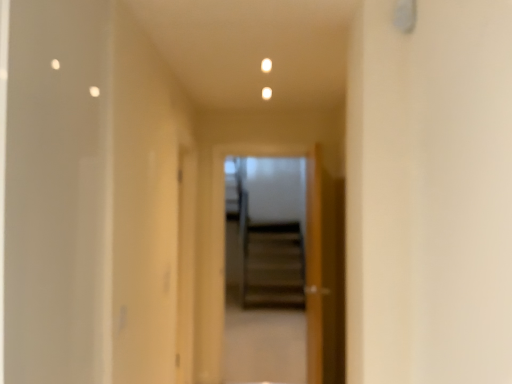
From the picture: Measure the distance between wooden door at center and camera.

wooden door at center is 8.91 feet from camera.

Describe the element at coordinates (314, 266) in the screenshot. I see `wooden door at center` at that location.

This screenshot has height=384, width=512. Find the location of `wooden door at center`. wooden door at center is located at coordinates (314, 266).

In order to face transparent glass screen door at center, should I rotate leftwards or rightwards?

You should rotate right by 0.951 degrees.

Find the location of a particular element. The image size is (512, 384). transparent glass screen door at center is located at coordinates (283, 240).

Describe the element at coordinates (283, 240) in the screenshot. I see `transparent glass screen door at center` at that location.

This screenshot has width=512, height=384. What are the coordinates of `wooden door at center` in the screenshot? It's located at (314, 266).

Is wooden door at center to the left or to the right of transparent glass screen door at center in the image?

wooden door at center is to the right of transparent glass screen door at center.

Which object is further away from the camera taking this photo, wooden door at center or transparent glass screen door at center?

transparent glass screen door at center is more distant.

Does point (316, 206) lie in front of point (259, 188)?

Yes, it is in front of point (259, 188).

From the image's perspective, between wooden door at center and transparent glass screen door at center, which one is located above?

transparent glass screen door at center is shown above in the image.

From a real-world perspective, between wooden door at center and transparent glass screen door at center, who is vertically higher?

In real-world perspective, transparent glass screen door at center is above.

Does wooden door at center have a greater width compared to transparent glass screen door at center?

Correct, the width of wooden door at center exceeds that of transparent glass screen door at center.

Can you confirm if wooden door at center is shorter than transparent glass screen door at center?

Yes.

Consider the image. Between wooden door at center and transparent glass screen door at center, which one has smaller size?

transparent glass screen door at center is smaller.

Is transparent glass screen door at center inside wooden door at center?

Actually, transparent glass screen door at center is outside wooden door at center.

Would you consider wooden door at center to be distant from transparent glass screen door at center?

Yes.

Does wooden door at center turn towards transparent glass screen door at center?

Yes.

Measure the distance from wooden door at center to transparent glass screen door at center.

9.28 feet.

The width and height of the screenshot is (512, 384). Identify the location of screen door to the left of wooden door at center. pyautogui.click(x=283, y=240).

Visually, is transparent glass screen door at center positioned to the left or to the right of wooden door at center?

Clearly, transparent glass screen door at center is on the left of wooden door at center in the image.

Looking at this image, which is behind, transparent glass screen door at center or wooden door at center?

transparent glass screen door at center is more distant.

Is point (313, 168) positioned before point (317, 150)?

No, it is not.

From the image's perspective, which object appears higher, transparent glass screen door at center or wooden door at center?

From the image's view, transparent glass screen door at center is above.

From a real-world perspective, relative to wooden door at center, is transparent glass screen door at center vertically above or below?

transparent glass screen door at center is above wooden door at center.

Which object is wider, transparent glass screen door at center or wooden door at center?

wooden door at center.

Considering the sizes of transparent glass screen door at center and wooden door at center in the image, is transparent glass screen door at center taller or shorter than wooden door at center?

transparent glass screen door at center is taller than wooden door at center.

Considering the relative sizes of transparent glass screen door at center and wooden door at center in the image provided, is transparent glass screen door at center bigger than wooden door at center?

No, transparent glass screen door at center is not bigger than wooden door at center.

Would you say transparent glass screen door at center is inside or outside wooden door at center?

transparent glass screen door at center is outside wooden door at center.

Can you see transparent glass screen door at center touching wooden door at center?

No, transparent glass screen door at center is not with wooden door at center.

Does transparent glass screen door at center turn towards wooden door at center?

No, transparent glass screen door at center is not facing towards wooden door at center.

What's the angular difference between transparent glass screen door at center and wooden door at center's facing directions?

There is a 93.8-degree angle between the facing directions of transparent glass screen door at center and wooden door at center.

Measure the distance from transparent glass screen door at center to wooden door at center.

transparent glass screen door at center and wooden door at center are 9.28 feet apart.

This screenshot has height=384, width=512. Identify the location of screen door that is on the left side of wooden door at center. point(283,240).

Find the location of `door in front of the transparent glass screen door at center`. door in front of the transparent glass screen door at center is located at coordinates (314, 266).

There is a wooden door at center. Identify the location of screen door above it (from a real-world perspective). The width and height of the screenshot is (512, 384). (283, 240).